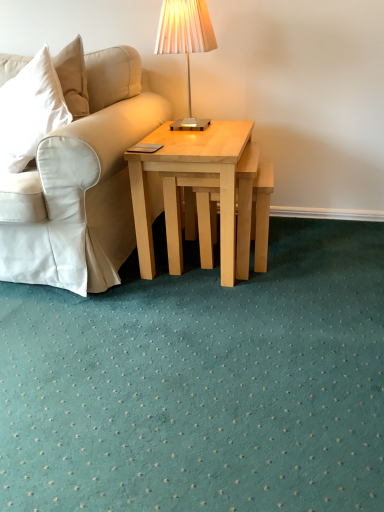
Question: Can you confirm if light wood stool at center is positioned to the right of natural wood coffee table at center?

Choices:
 (A) no
 (B) yes

Answer: (B)

Question: Would you say natural wood coffee table at center is part of light wood stool at center's contents?

Choices:
 (A) no
 (B) yes

Answer: (A)

Question: Is light wood stool at center not inside natural wood coffee table at center?

Choices:
 (A) no
 (B) yes

Answer: (A)

Question: Is light wood stool at center positioned in front of natural wood coffee table at center?

Choices:
 (A) no
 (B) yes

Answer: (A)

Question: Is the depth of light wood stool at center greater than that of natural wood coffee table at center?

Choices:
 (A) yes
 (B) no

Answer: (A)

Question: From a real-world perspective, is light wood stool at center above or below metallic silver table lamp at upper center?

Choices:
 (A) below
 (B) above

Answer: (A)

Question: Considering the positions of light wood stool at center and metallic silver table lamp at upper center in the image, is light wood stool at center taller or shorter than metallic silver table lamp at upper center?

Choices:
 (A) tall
 (B) short

Answer: (B)

Question: Is light wood stool at center bigger or smaller than metallic silver table lamp at upper center?

Choices:
 (A) big
 (B) small

Answer: (A)

Question: Is point (261, 168) positioned closer to the camera than point (165, 14)?

Choices:
 (A) closer
 (B) farther

Answer: (B)

Question: Considering the positions of natural wood coffee table at center and light wood stool at center in the image, is natural wood coffee table at center taller or shorter than light wood stool at center?

Choices:
 (A) short
 (B) tall

Answer: (B)

Question: Is point (205, 133) positioned closer to the camera than point (264, 266)?

Choices:
 (A) farther
 (B) closer

Answer: (B)

Question: Would you say natural wood coffee table at center is to the left or to the right of light wood stool at center in the picture?

Choices:
 (A) right
 (B) left

Answer: (B)

Question: In terms of size, does natural wood coffee table at center appear bigger or smaller than light wood stool at center?

Choices:
 (A) small
 (B) big

Answer: (B)

Question: Looking at their shapes, would you say metallic silver table lamp at upper center is wider or thinner than light wood stool at center?

Choices:
 (A) wide
 (B) thin

Answer: (B)

Question: From the image's perspective, is metallic silver table lamp at upper center located above or below light wood stool at center?

Choices:
 (A) above
 (B) below

Answer: (A)